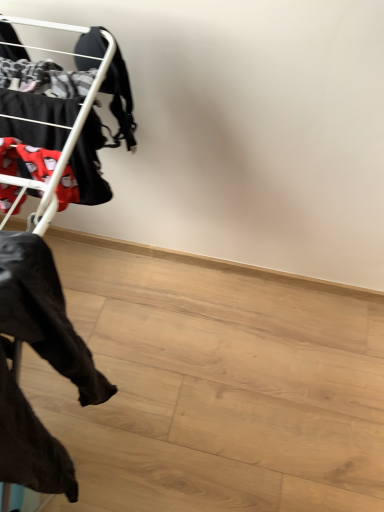
Question: Looking at the image, does black fabric pants at left seem bigger or smaller compared to matte black clothing rack at left?

Choices:
 (A) big
 (B) small

Answer: (A)

Question: Considering the positions of black fabric pants at left and matte black clothing rack at left in the image, is black fabric pants at left wider or thinner than matte black clothing rack at left?

Choices:
 (A) wide
 (B) thin

Answer: (B)

Question: Do you think black fabric pants at left is within matte black clothing rack at left, or outside of it?

Choices:
 (A) inside
 (B) outside

Answer: (B)

Question: Is matte black clothing rack at left to the left or to the right of black fabric pants at left in the image?

Choices:
 (A) left
 (B) right

Answer: (A)

Question: From a real-world perspective, is matte black clothing rack at left above or below black fabric pants at left?

Choices:
 (A) below
 (B) above

Answer: (B)

Question: Would you say matte black clothing rack at left is inside or outside black fabric pants at left?

Choices:
 (A) inside
 (B) outside

Answer: (B)

Question: Based on their sizes in the image, would you say matte black clothing rack at left is bigger or smaller than black fabric pants at left?

Choices:
 (A) big
 (B) small

Answer: (B)